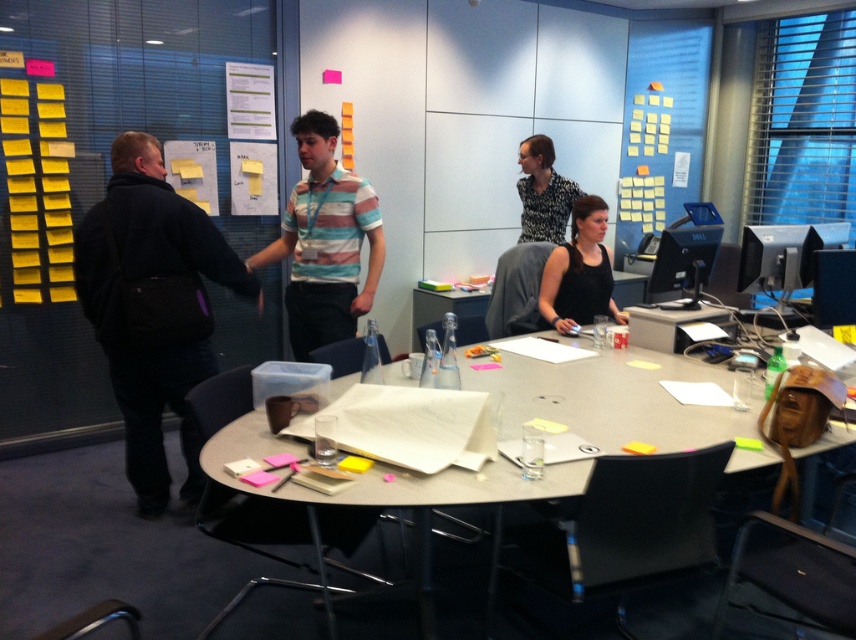
Who is taller, matte gray table at center or black matte tank top at center?

black matte tank top at center

Can you confirm if matte gray table at center is wider than black matte tank top at center?

Correct, the width of matte gray table at center exceeds that of black matte tank top at center.

Does point (251, 451) come farther from viewer compared to point (591, 221)?

No.

This screenshot has height=640, width=856. Find the location of `matte gray table at center`. matte gray table at center is located at coordinates (613, 400).

Measure the distance between point (x=129, y=381) and camera.

9.53 feet

Who is positioned more to the left, dark gray jacket at left or striped cotton shirt at center?

From the viewer's perspective, dark gray jacket at left appears more on the left side.

Is point (116, 285) less distant than point (302, 264)?

Yes.

Image resolution: width=856 pixels, height=640 pixels. What are the coordinates of `dark gray jacket at left` in the screenshot? It's located at 128,312.

Between point (717, 426) and point (538, 140), which one is positioned behind?

The point (538, 140) is more distant.

Does matte gray table at center appear on the left side of printed fabric blouse at center?

Indeed, matte gray table at center is positioned on the left side of printed fabric blouse at center.

What do you see at coordinates (613, 400) in the screenshot?
I see `matte gray table at center` at bounding box center [613, 400].

Where is `matte gray table at center`? matte gray table at center is located at coordinates (613, 400).